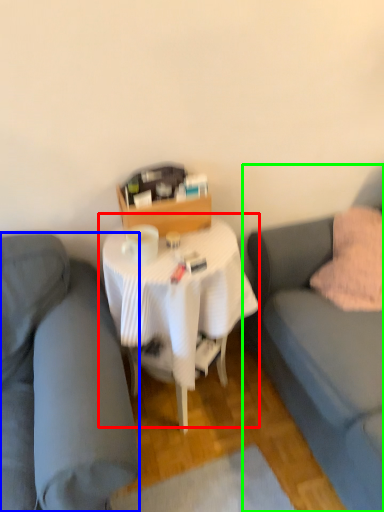
Question: Which object is positioned closest to table (highlighted by a red box)? Select from studio couch (highlighted by a blue box) and studio couch (highlighted by a green box).

Choices:
 (A) studio couch
 (B) studio couch

Answer: (A)